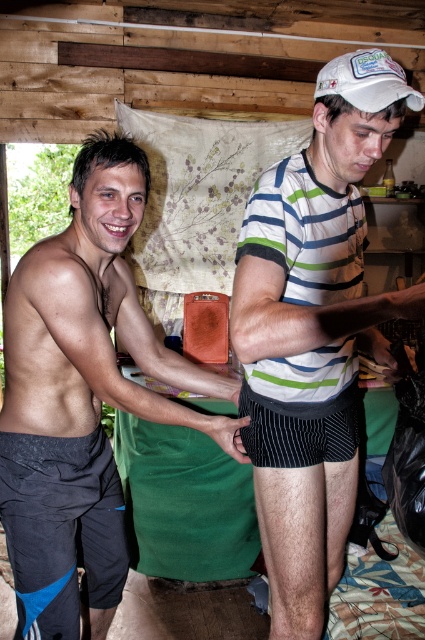
You are a photographer standing in front of the two people in the rustic cabin. You need to take a photo that clearly shows both the striped cotton shirt at center and the black matte shorts at left. Based on their positions, which object should you focus on first to ensure both are in focus?

The striped cotton shirt at center is in front of the black matte shorts at left, so you should focus on the striped cotton shirt at center first to ensure both are in focus.

You are a fashion designer analyzing clothing items in the image. Which clothing item, the striped cotton shirt at center or the black synthetic shorts at lower left, has a greater width?

The striped cotton shirt at center has a greater width than the black synthetic shorts at lower left according to the description.

You are designing a catalog layout and need to place the striped cotton shirt at center and black matte shorts at left. If the catalog has limited space, which item should you prioritize placing first to ensure it fits?

The striped cotton shirt at center is larger in size than the black matte shorts at left, so you should prioritize placing the striped cotton shirt at center first to accommodate its larger size.